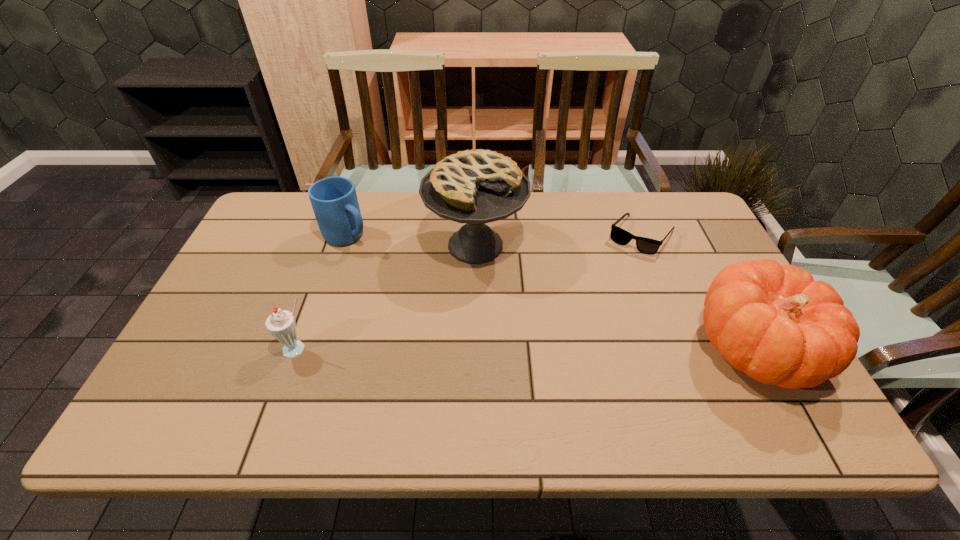
Find the location of a particular element. object that is positioned at the near edge is located at coordinates (773, 322).

Find the location of a particular element. This screenshot has height=540, width=960. pumpkin situated at the right edge is located at coordinates (773, 322).

Identify the location of sunglasses that is positioned at the right edge. The width and height of the screenshot is (960, 540). (618, 235).

Find the location of `object that is positioned at the far right corner`. object that is positioned at the far right corner is located at coordinates (618, 235).

The image size is (960, 540). I want to click on object present at the near right corner, so click(x=773, y=322).

Image resolution: width=960 pixels, height=540 pixels. Identify the location of vacant space at the far edge. (617, 200).

Find the location of a particular element. free region at the near edge of the desktop is located at coordinates (415, 367).

In the image, there is a desktop. Where is `vacant space at the left edge`? The height and width of the screenshot is (540, 960). vacant space at the left edge is located at coordinates (237, 281).

You are a GUI agent. You are given a task and a screenshot of the screen. Output one action in this format:
    pyautogui.click(x=<x>, y=<y>)
    Task: Click on the vacant space at the right edge of the desktop
    
    Given the screenshot: What is the action you would take?
    pyautogui.click(x=710, y=245)

The height and width of the screenshot is (540, 960). I want to click on vacant region at the far left corner of the desktop, so click(270, 200).